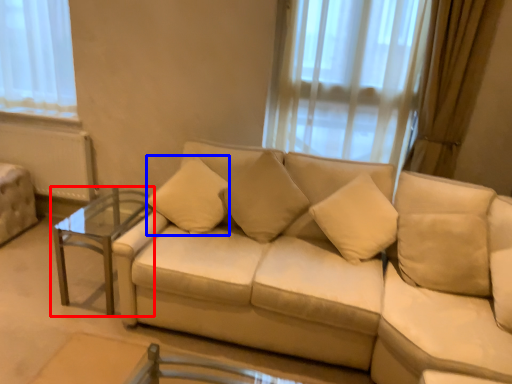
Question: Which point is closer to the camera, table (highlighted by a red box) or pillow (highlighted by a blue box)?

Choices:
 (A) table
 (B) pillow

Answer: (A)